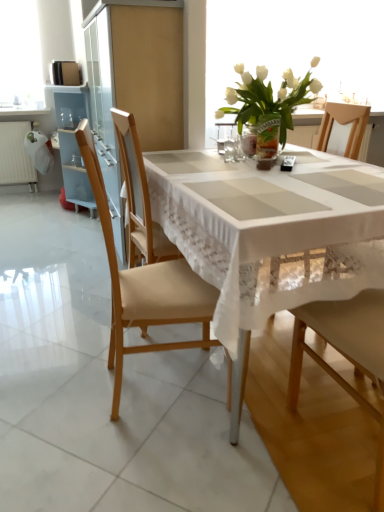
The height and width of the screenshot is (512, 384). Identify the location of white painted radiator at left. (16, 156).

This screenshot has height=512, width=384. In order to click on clear glass vase at center, which appears as the first tableware when viewed from the right in this screenshot , I will do `click(238, 149)`.

Image resolution: width=384 pixels, height=512 pixels. Find the location of `white glass vase at upper center`. white glass vase at upper center is located at coordinates (267, 97).

What is the approximate height of white glass vase at upper center?

white glass vase at upper center is 37.38 inches in height.

What do you see at coordinates (346, 353) in the screenshot? The height and width of the screenshot is (512, 384). I see `wooden chair at center, marked as the first chair in a right-to-left arrangement` at bounding box center [346, 353].

In order to click on white painted radiator at left in this screenshot , I will do `click(16, 156)`.

Would you say clear glass vase at center, the second tableware viewed from the left, is inside or outside light brown wood chair at left, the first chair when ordered from left to right?

The correct answer is: outside.

Considering the relative positions of clear glass vase at center, which appears as the first tableware when viewed from the right, and light brown wood chair at left, the first chair when ordered from left to right, in the image provided, is clear glass vase at center, which appears as the first tableware when viewed from the right, to the right of light brown wood chair at left, the first chair when ordered from left to right, from the viewer's perspective?

Correct, you'll find clear glass vase at center, which appears as the first tableware when viewed from the right, to the right of light brown wood chair at left, the first chair when ordered from left to right.

Is clear glass vase at center, the second tableware viewed from the left, aimed at light brown wood chair at left, acting as the 2th chair starting from the right?

No, clear glass vase at center, the second tableware viewed from the left, is not turned towards light brown wood chair at left, acting as the 2th chair starting from the right.

Are white painted radiator at left and white lace tablecloth at center located far from each other?

Indeed, white painted radiator at left is not near white lace tablecloth at center.

Is white painted radiator at left surrounding white lace tablecloth at center?

That's incorrect, white lace tablecloth at center is not inside white painted radiator at left.

Can you confirm if white painted radiator at left is positioned to the left of white lace tablecloth at center?

Yes.

In order to click on kitchen & dining room table that appears on the right of white painted radiator at left in this screenshot , I will do `click(269, 236)`.

From the image's perspective, relative to white painted radiator at left, is translucent glass vase at center above or below?

translucent glass vase at center is situated lower than white painted radiator at left in the image.

Considering the points (271, 115) and (18, 170), which point is in front, point (271, 115) or point (18, 170)?

The point (271, 115) is closer to the camera.

Is translucent glass vase at center looking in the opposite direction of white painted radiator at left?

translucent glass vase at center does not have its back to white painted radiator at left.

Can you tell me how much translucent glass vase at center and white painted radiator at left differ in facing direction?

They differ by 38 degrees in their facing directions.

Which object is further away from the camera, white glass vase at upper center or white glass vase at upper center?

white glass vase at upper center is behind.

From a real-world perspective, is white glass vase at upper center physically above white glass vase at upper center?

Correct, in the physical world, white glass vase at upper center is higher than white glass vase at upper center.

Is white glass vase at upper center inside or outside of white glass vase at upper center?

white glass vase at upper center is outside white glass vase at upper center.

Does white glass vase at upper center have a larger size compared to white glass vase at upper center?

Indeed, white glass vase at upper center has a larger size compared to white glass vase at upper center.

Is translucent glass vase at center oriented away from translucent glass vase at center, which appears as the 2th tableware when viewed from the right?

That's not correct — translucent glass vase at center is not looking away from translucent glass vase at center, which appears as the 2th tableware when viewed from the right.

Measure the distance from translucent glass vase at center to translucent glass vase at center, which appears as the 2th tableware when viewed from the right.

translucent glass vase at center is 6.35 inches away from translucent glass vase at center, which appears as the 2th tableware when viewed from the right.

Is translucent glass vase at center, which is counted as the 1th tableware, starting from the left, completely or partially inside translucent glass vase at center?

Definitely not — translucent glass vase at center, which is counted as the 1th tableware, starting from the left, is not inside translucent glass vase at center.

From the image's perspective, does translucent glass vase at center appear higher than translucent glass vase at center, which is counted as the 1th tableware, starting from the left?

Yes.

From a real-world perspective, is wooden chair at center, the 2th chair when ordered from left to right, above or below translucent glass vase at center?

From a real-world perspective, wooden chair at center, the 2th chair when ordered from left to right, is physically below translucent glass vase at center.

Is wooden chair at center, marked as the first chair in a right-to-left arrangement, oriented towards translucent glass vase at center?

Yes, wooden chair at center, marked as the first chair in a right-to-left arrangement, is turned towards translucent glass vase at center.

Considering the points (316, 362) and (268, 156), which point is in front, point (316, 362) or point (268, 156)?

Positioned in front is point (316, 362).

Is wooden chair at center, marked as the first chair in a right-to-left arrangement, to the right of translucent glass vase at center from the viewer's perspective?

Indeed, wooden chair at center, marked as the first chair in a right-to-left arrangement, is positioned on the right side of translucent glass vase at center.

Is clear glass vase at center, which appears as the first tableware when viewed from the right, in contact with translucent glass vase at center?

clear glass vase at center, which appears as the first tableware when viewed from the right, and translucent glass vase at center are clearly separated.

Based on the photo, from a real-world perspective, is clear glass vase at center, which appears as the first tableware when viewed from the right, located higher than translucent glass vase at center?

Incorrect, from a real-world perspective, clear glass vase at center, which appears as the first tableware when viewed from the right, is lower than translucent glass vase at center.

From the image's perspective, is clear glass vase at center, which appears as the first tableware when viewed from the right, located above translucent glass vase at center?

No.

Can you confirm if clear glass vase at center, the second tableware viewed from the left, is wider than translucent glass vase at center?

No, clear glass vase at center, the second tableware viewed from the left, is not wider than translucent glass vase at center.

This screenshot has height=512, width=384. Identify the location of chair to the left of clear glass vase at center, the second tableware viewed from the left. (146, 287).

The width and height of the screenshot is (384, 512). I want to click on radiator above the white lace tablecloth at center (from the image's perspective), so click(16, 156).

Which object lies further to the anchor point white painted radiator at left, white glass vase at upper center or white glass vase at upper center?

The object further to white painted radiator at left is white glass vase at upper center.

When comparing their distances from white painted radiator at left, does clear glass vase at center, which appears as the first tableware when viewed from the right, or wooden chair at center, marked as the first chair in a right-to-left arrangement, seem closer?

clear glass vase at center, which appears as the first tableware when viewed from the right.

When comparing their distances from wooden chair at center, marked as the first chair in a right-to-left arrangement, does translucent glass vase at center or clear glass vase at center, the second tableware viewed from the left, seem closer?

clear glass vase at center, the second tableware viewed from the left, lies closer to wooden chair at center, marked as the first chair in a right-to-left arrangement, than the other object.

Which object lies further to the anchor point white painted radiator at left, translucent glass vase at center or white lace tablecloth at center?

white lace tablecloth at center lies further to white painted radiator at left than the other object.

Looking at this image, based on their spatial positions, is light brown wood chair at left, acting as the 2th chair starting from the right, or wooden chair at center, marked as the first chair in a right-to-left arrangement, closer to translucent glass vase at center, which appears as the 2th tableware when viewed from the right?

The object closer to translucent glass vase at center, which appears as the 2th tableware when viewed from the right, is light brown wood chair at left, acting as the 2th chair starting from the right.

Based on their spatial positions, is light brown wood chair at left, the first chair when ordered from left to right, or translucent glass vase at center, which appears as the 2th tableware when viewed from the right, further from white glass vase at upper center?

light brown wood chair at left, the first chair when ordered from left to right, is positioned further to the anchor white glass vase at upper center.

Looking at the image, which one is located closer to white glass vase at upper center, white lace tablecloth at center or white glass vase at upper center?

white lace tablecloth at center is closer to white glass vase at upper center.

Based on their spatial positions, is white glass vase at upper center or white lace tablecloth at center further from white painted radiator at left?

Among the two, white lace tablecloth at center is located further to white painted radiator at left.

Find the location of a particular element. This screenshot has width=384, height=512. chair between wooden chair at center, the 2th chair when ordered from left to right, and white glass vase at upper center, along the z-axis is located at coordinates (146, 287).

You are a GUI agent. You are given a task and a screenshot of the screen. Output one action in this format:
    pyautogui.click(x=<x>, y=<y>)
    Task: Click on the kitchen & dining room table located between wooden chair at center, the 2th chair when ordered from left to right, and white painted radiator at left in the depth direction
    The height and width of the screenshot is (512, 384).
    Given the screenshot: What is the action you would take?
    pyautogui.click(x=269, y=236)

This screenshot has width=384, height=512. What are the coordinates of `vase between translucent glass vase at center, which is counted as the 1th tableware, starting from the left, and white painted radiator at left from front to back` in the screenshot? It's located at (268, 135).

You are a GUI agent. You are given a task and a screenshot of the screen. Output one action in this format:
    pyautogui.click(x=<x>, y=<y>)
    Task: Click on the kitchen & dining room table positioned between wooden chair at center, marked as the first chair in a right-to-left arrangement, and white glass vase at upper center from near to far
    The image size is (384, 512).
    Given the screenshot: What is the action you would take?
    pyautogui.click(x=269, y=236)